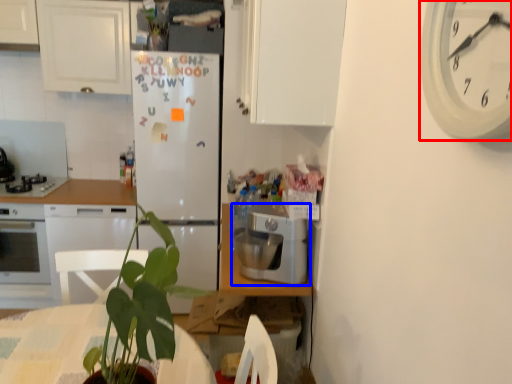
Question: Which point is further to the camera, clock (highlighted by a red box) or kitchen appliance (highlighted by a blue box)?

Choices:
 (A) clock
 (B) kitchen appliance

Answer: (B)